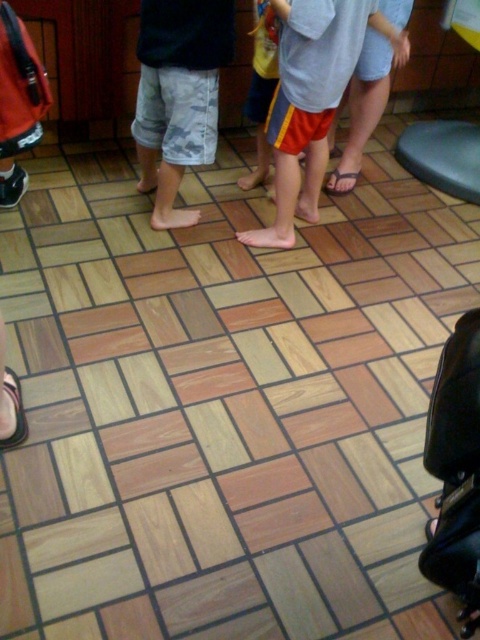
You are standing in a room with tiled floors. You need to reach a point that is exactly 2 meters away from where you are currently standing. If you move towards the point labeled as point (182,45), will you be able to reach the desired distance?

Yes, because the distance of point (182,45) from camera is 2.03 meters, which is very close to 2 meters. You can reach the desired distance by moving to that point.

You are a photographer setting up a shoot in this indoor space. You need to place a large prop that requires more space than the matte red shorts at center. Will the white rubber sandal at lower left have enough space to accommodate the prop?

The matte red shorts at center is bigger than the white rubber sandal at lower left, so the white rubber sandal at lower left may not have enough space to accommodate the prop that requires more space than the matte red shorts at center.